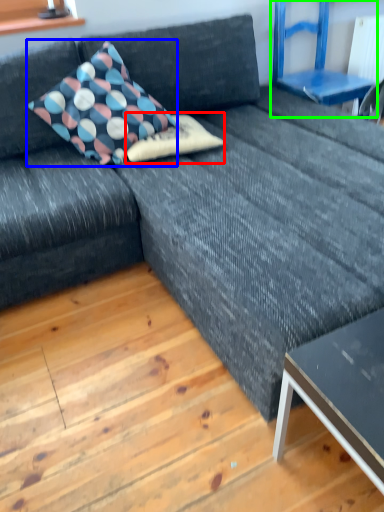
Question: Estimate the real-world distances between objects in this image. Which object is closer to pillow (highlighted by a red box), pillow (highlighted by a blue box) or armchair (highlighted by a green box)?

Choices:
 (A) pillow
 (B) armchair

Answer: (A)